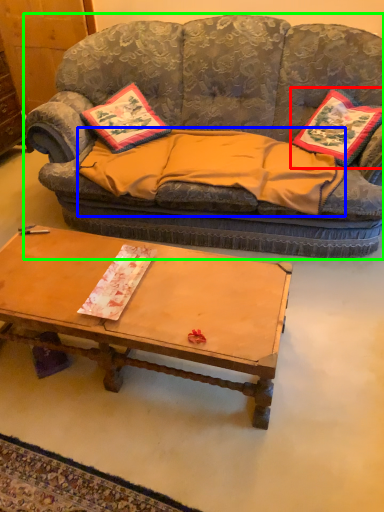
Question: Estimate the real-world distances between objects in this image. Which object is farther from pillow (highlighted by a red box), blanket (highlighted by a blue box) or studio couch (highlighted by a green box)?

Choices:
 (A) blanket
 (B) studio couch

Answer: (B)